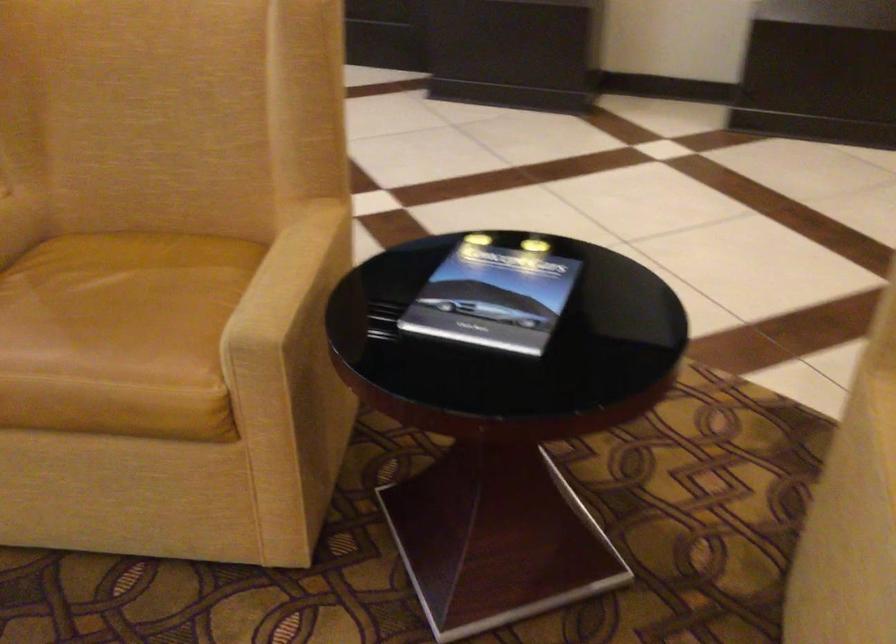
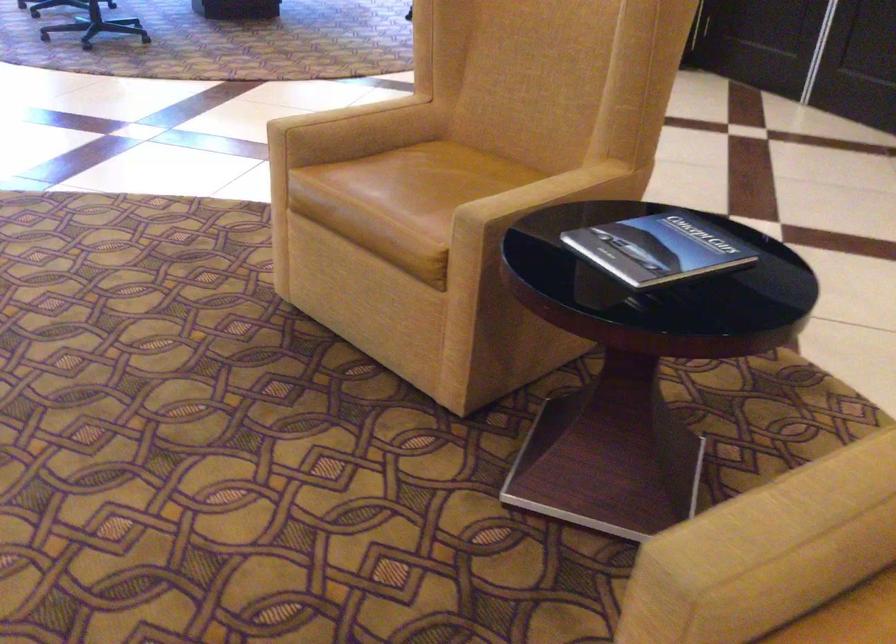
Where in the second image is the point corresponding to pixel 509 298 from the first image?

(657, 249)